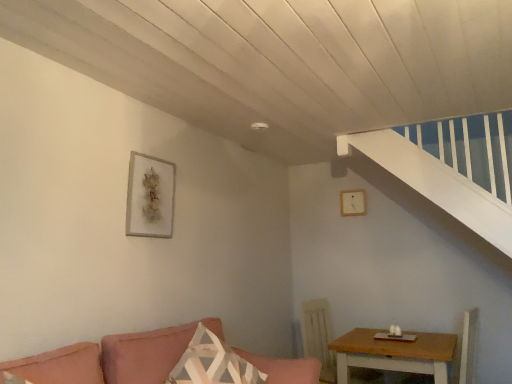
Question: Is matte gray picture frame at upper left, marked as the 2th picture frame in a back-to-front arrangement, not within light brown wooden table at lower right?

Choices:
 (A) no
 (B) yes

Answer: (B)

Question: Considering the relative sizes of matte gray picture frame at upper left, the first picture frame in the front-to-back sequence, and light brown wooden table at lower right in the image provided, is matte gray picture frame at upper left, the first picture frame in the front-to-back sequence, bigger than light brown wooden table at lower right?

Choices:
 (A) yes
 (B) no

Answer: (B)

Question: Can you confirm if matte gray picture frame at upper left, marked as the 2th picture frame in a back-to-front arrangement, is positioned to the right of light brown wooden table at lower right?

Choices:
 (A) yes
 (B) no

Answer: (B)

Question: Does matte gray picture frame at upper left, marked as the second picture frame in a right-to-left arrangement, have a smaller size compared to light brown wooden table at lower right?

Choices:
 (A) no
 (B) yes

Answer: (B)

Question: Is matte gray picture frame at upper left, marked as the first picture frame in a left-to-right arrangement, in front of light brown wooden table at lower right?

Choices:
 (A) no
 (B) yes

Answer: (B)

Question: Considering their positions, is pink fabric couch at lower left located in front of or behind matte gray picture frame at upper left, marked as the 2th picture frame in a back-to-front arrangement?

Choices:
 (A) behind
 (B) front

Answer: (B)

Question: Looking at their shapes, would you say pink fabric couch at lower left is wider or thinner than matte gray picture frame at upper left, the first picture frame in the front-to-back sequence?

Choices:
 (A) wide
 (B) thin

Answer: (A)

Question: In terms of size, does pink fabric couch at lower left appear bigger or smaller than matte gray picture frame at upper left, marked as the first picture frame in a left-to-right arrangement?

Choices:
 (A) big
 (B) small

Answer: (A)

Question: In terms of height, does pink fabric couch at lower left look taller or shorter compared to matte gray picture frame at upper left, marked as the first picture frame in a left-to-right arrangement?

Choices:
 (A) tall
 (B) short

Answer: (B)

Question: Is point (137, 201) closer or farther from the camera than point (430, 347)?

Choices:
 (A) closer
 (B) farther

Answer: (A)

Question: From a real-world perspective, is matte gray picture frame at upper left, marked as the first picture frame in a left-to-right arrangement, positioned above or below light brown wooden table at lower right?

Choices:
 (A) above
 (B) below

Answer: (A)

Question: Would you say matte gray picture frame at upper left, marked as the second picture frame in a right-to-left arrangement, is inside or outside light brown wooden table at lower right?

Choices:
 (A) inside
 (B) outside

Answer: (B)

Question: Considering their positions, is matte gray picture frame at upper left, the first picture frame in the front-to-back sequence, located in front of or behind light brown wooden table at lower right?

Choices:
 (A) behind
 (B) front

Answer: (B)

Question: Considering the positions of matte gray picture frame at upper left, the first picture frame in the front-to-back sequence, and pink fabric couch at lower left in the image, is matte gray picture frame at upper left, the first picture frame in the front-to-back sequence, wider or thinner than pink fabric couch at lower left?

Choices:
 (A) wide
 (B) thin

Answer: (B)

Question: Based on their positions, is matte gray picture frame at upper left, the first picture frame in the front-to-back sequence, located to the left or right of pink fabric couch at lower left?

Choices:
 (A) left
 (B) right

Answer: (A)